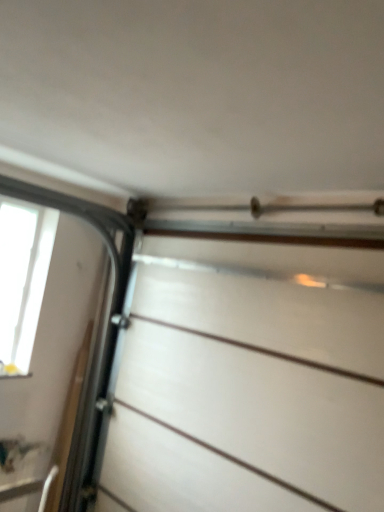
This screenshot has width=384, height=512. I want to click on transparent glass window at left, so click(x=23, y=278).

What do you see at coordinates (23, 278) in the screenshot? This screenshot has width=384, height=512. I see `transparent glass window at left` at bounding box center [23, 278].

Identify the location of white matte drawer at center. The width and height of the screenshot is (384, 512). (262, 408).

What do you see at coordinates (262, 408) in the screenshot? I see `white matte drawer at center` at bounding box center [262, 408].

This screenshot has height=512, width=384. Identify the location of transparent glass window at left. (23, 278).

Considering the relative positions of transparent glass window at left and white matte drawer at center in the image provided, is transparent glass window at left to the left of white matte drawer at center from the viewer's perspective?

Correct, you'll find transparent glass window at left to the left of white matte drawer at center.

Which object is further away from the camera, transparent glass window at left or white matte drawer at center?

Positioned behind is transparent glass window at left.

Between point (51, 212) and point (134, 397), which one is positioned in front?

Positioned in front is point (134, 397).

From the image's perspective, which is below, transparent glass window at left or white matte drawer at center?

From the image's view, white matte drawer at center is below.

From a real-world perspective, between transparent glass window at left and white matte drawer at center, who is vertically lower?

white matte drawer at center, from a real-world perspective.

Between transparent glass window at left and white matte drawer at center, which one has larger width?

white matte drawer at center.

Does transparent glass window at left have a greater height compared to white matte drawer at center?

In fact, transparent glass window at left may be shorter than white matte drawer at center.

Based on the photo, which of these two, transparent glass window at left or white matte drawer at center, is bigger?

white matte drawer at center is bigger.

Is transparent glass window at left located outside white matte drawer at center?

Yes, transparent glass window at left is not within white matte drawer at center.

Is transparent glass window at left placed right next to white matte drawer at center?

No, transparent glass window at left is not touching white matte drawer at center.

Is transparent glass window at left turned away from white matte drawer at center?

No, transparent glass window at left is not facing away from white matte drawer at center.

Can you tell me how much transparent glass window at left and white matte drawer at center differ in facing direction?

They differ by 90.4 degrees in their facing directions.

The height and width of the screenshot is (512, 384). I want to click on window that is on the left side of white matte drawer at center, so click(x=23, y=278).

Does white matte drawer at center appear on the left side of transparent glass window at left?

No, white matte drawer at center is not to the left of transparent glass window at left.

Relative to transparent glass window at left, is white matte drawer at center in front or behind?

white matte drawer at center is positioned closer to the viewer than transparent glass window at left.

Based on the photo, which is less distant, (168, 327) or (20, 353)?

Point (168, 327) is positioned closer to the camera compared to point (20, 353).

From the image's perspective, is white matte drawer at center located above transparent glass window at left?

No, from the image's perspective, white matte drawer at center is not on top of transparent glass window at left.

From a real-world perspective, which object stands above the other?

In real-world perspective, transparent glass window at left is above.

Does white matte drawer at center have a greater width compared to transparent glass window at left?

Indeed, white matte drawer at center has a greater width compared to transparent glass window at left.

From the picture: Between white matte drawer at center and transparent glass window at left, which one has more height?

With more height is white matte drawer at center.

Which of these two, white matte drawer at center or transparent glass window at left, is smaller?

With smaller size is transparent glass window at left.

Would you say white matte drawer at center contains transparent glass window at left?

No, transparent glass window at left is not surrounded by white matte drawer at center.

Looking at this image, is white matte drawer at center with transparent glass window at left?

No, white matte drawer at center is not in contact with transparent glass window at left.

Is white matte drawer at center oriented towards transparent glass window at left?

No, white matte drawer at center is not facing towards transparent glass window at left.

Locate an element on the screen. This screenshot has width=384, height=512. drawer on the right of transparent glass window at left is located at coordinates (262, 408).

The image size is (384, 512). I want to click on drawer below the transparent glass window at left (from the image's perspective), so click(x=262, y=408).

Find the location of a particular element. drawer directly beneath the transparent glass window at left (from a real-world perspective) is located at coordinates (262, 408).